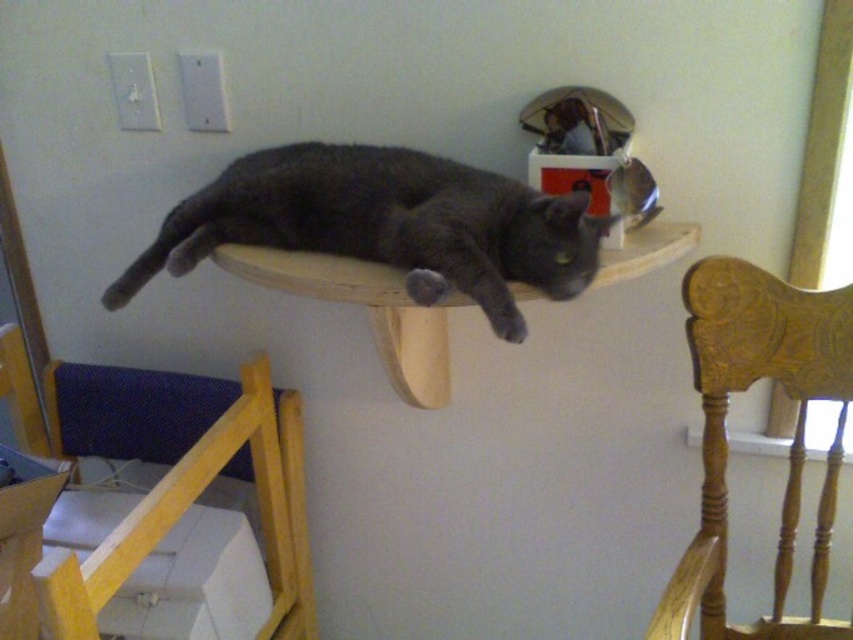
You are a photographer trying to capture the dark gray fur cat at center and the wooden at left in the scene. Based on their positions, which object is closer to the camera?

The dark gray fur cat at center is behind the wooden at left, so the wooden at left is closer to the camera.

In the scene shown: You are standing in the room and want to place a small decoration between the two points, point (x=428, y=280) and point (x=788, y=324). Which point should the decoration be closer to in order to be positioned between them?

The decoration should be closer to point (x=428, y=280) because it is in front of point (x=788, y=324).

You are an interior designer assessing the space. You need to place a new decorative item between the wooden at left and the wooden carved chair at right. Considering their sizes, which object should the item be placed closer to?

The wooden at left is larger in size than the wooden carved chair at right, so the new decorative item should be placed closer to the wooden carved chair at right to balance the visual weight.